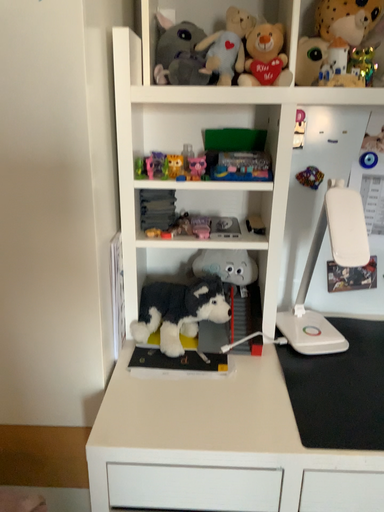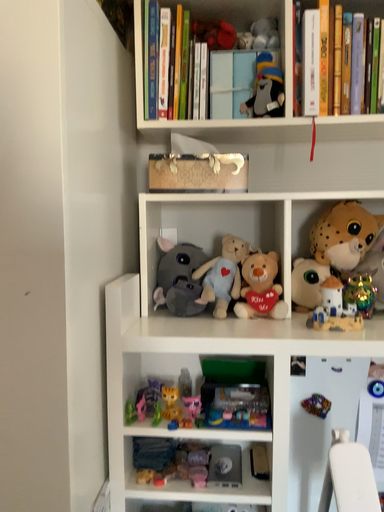
Question: How did the camera likely rotate when shooting the video?

Choices:
 (A) rotated downward
 (B) rotated upward

Answer: (B)